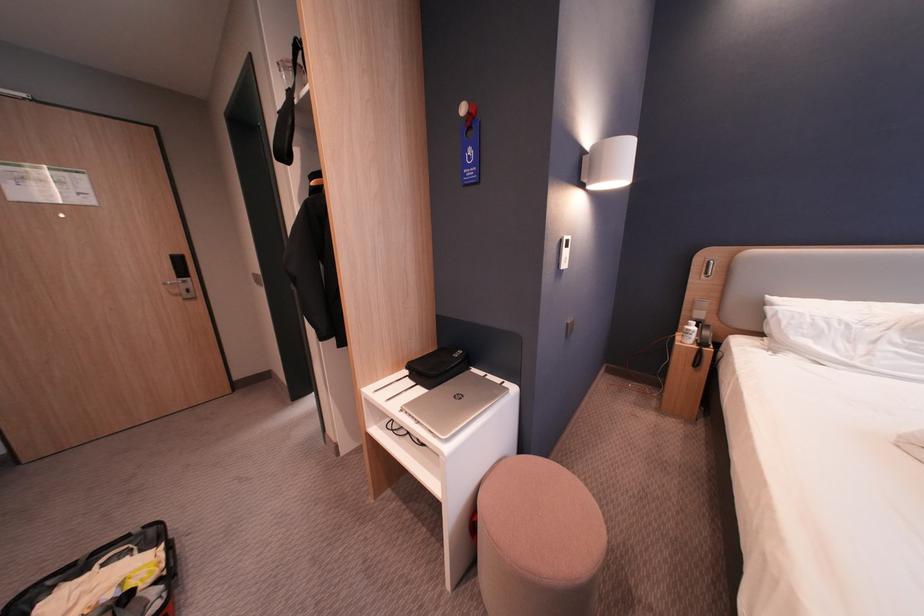
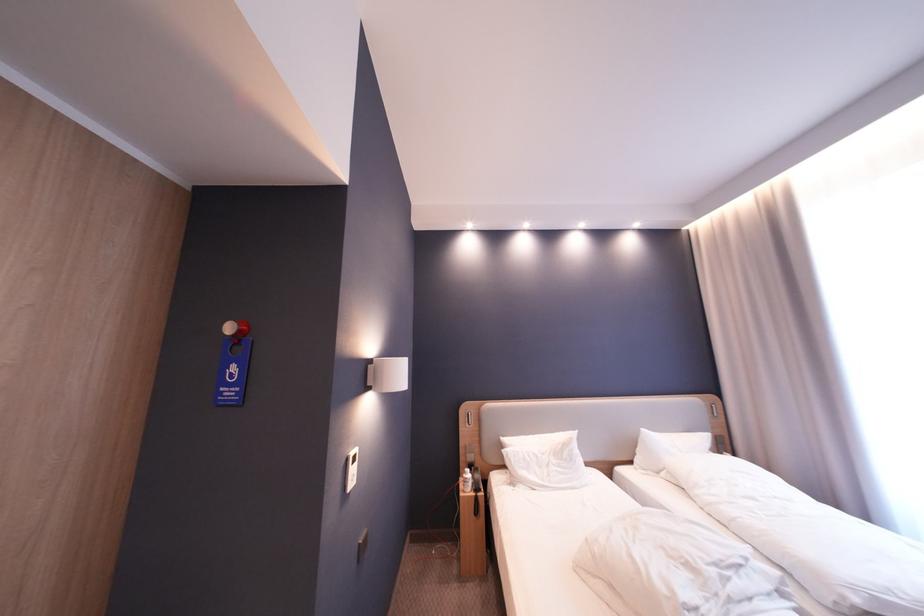
Where in the second image is the point corresponding to [688,334] from the first image?

(471, 479)